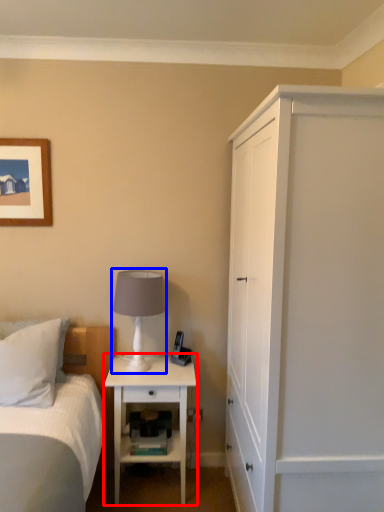
Question: Which object appears farthest to the camera in this image, nightstand (highlighted by a red box) or table lamp (highlighted by a blue box)?

Choices:
 (A) nightstand
 (B) table lamp

Answer: (A)